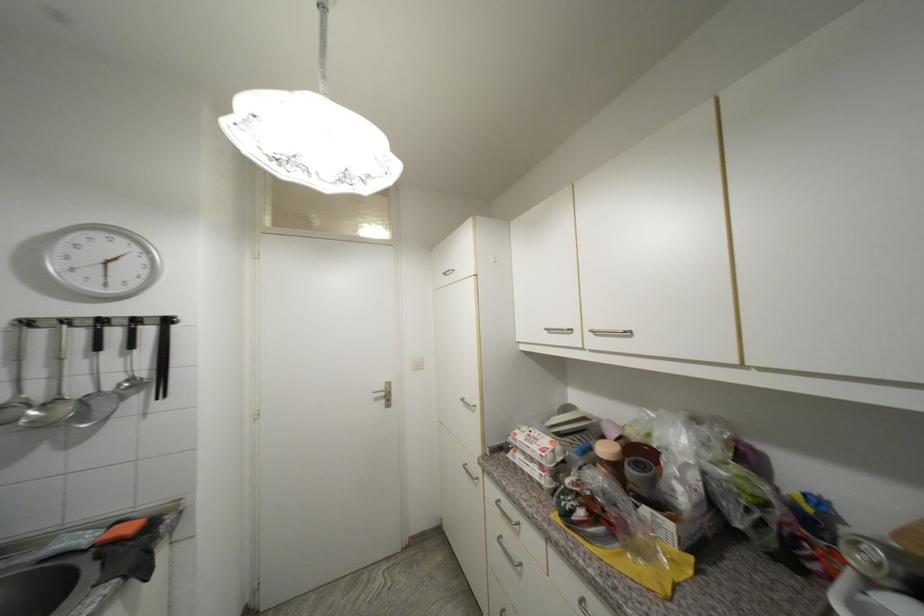
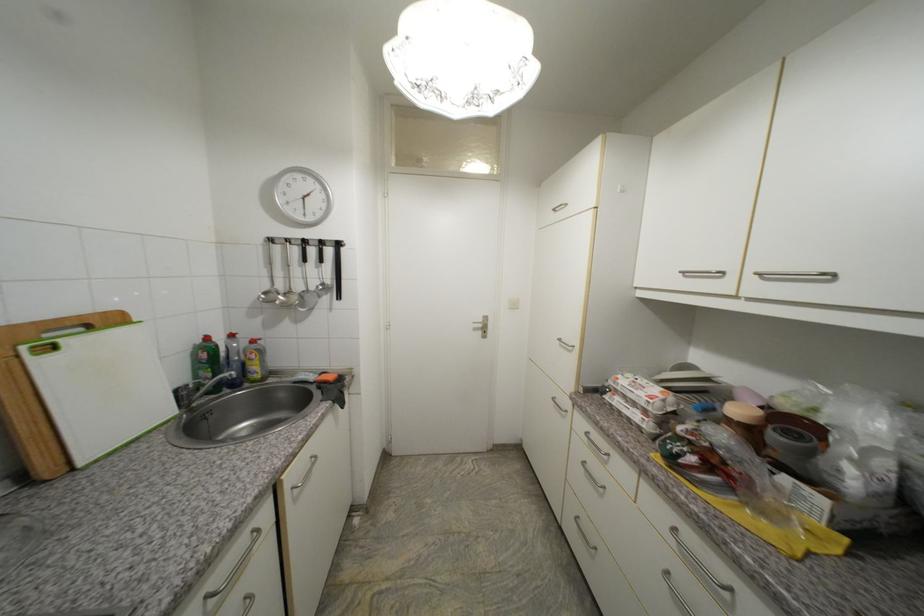
In a continuous first-person perspective shot, in which direction is the camera moving?

The cameraman moved toward left, backward.